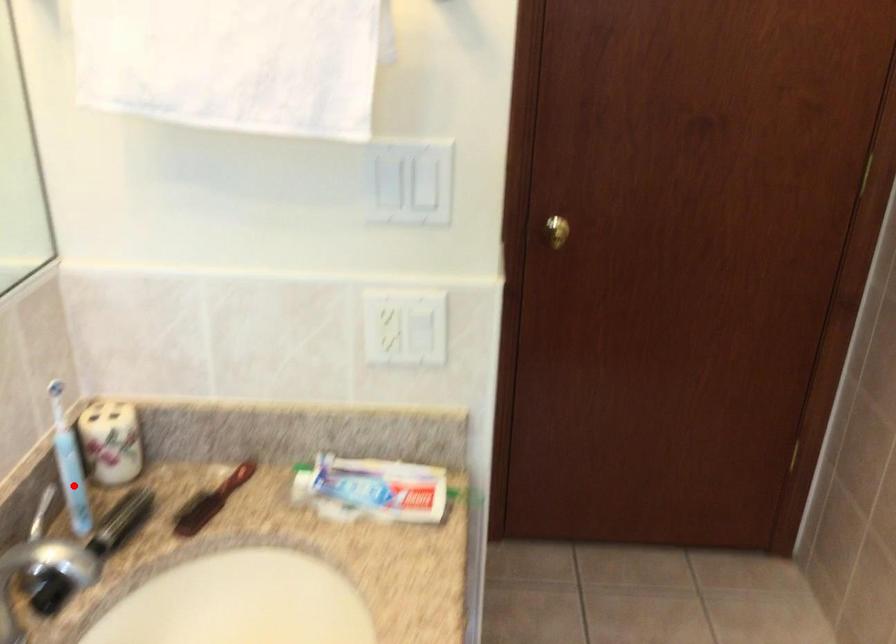
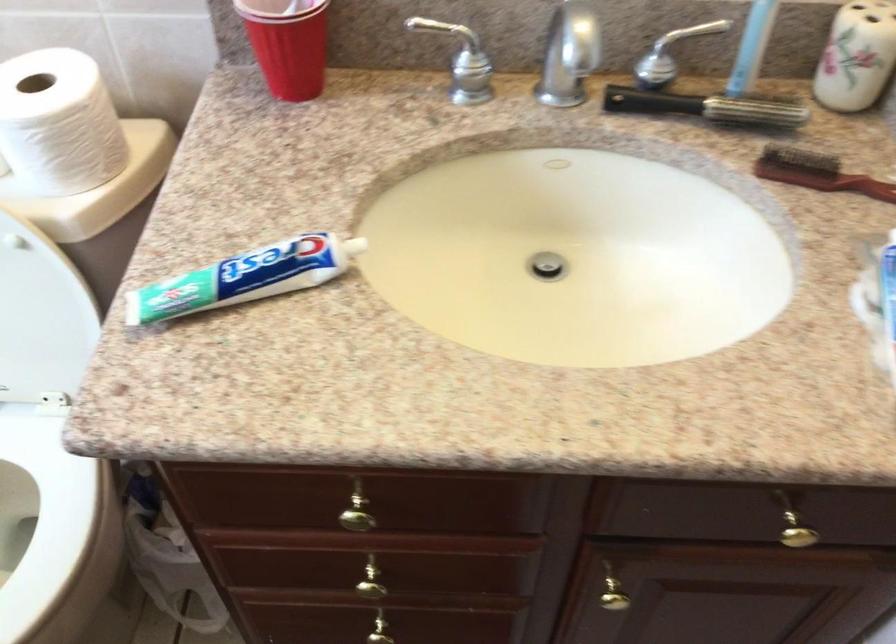
In the second image, find the point that corresponds to the highlighted location in the first image.

(752, 46)